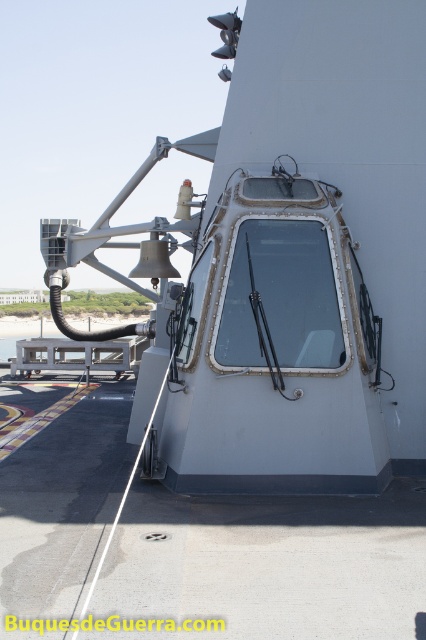
Question: Does gray concrete tarmac at center appear on the left side of transparent glass window at center?

Choices:
 (A) yes
 (B) no

Answer: (B)

Question: Is gray metallic hatch at center positioned behind white matte deck at center?

Choices:
 (A) yes
 (B) no

Answer: (B)

Question: Which point is farther to the camera?

Choices:
 (A) (250, 332)
 (B) (241, 577)
 (C) (334, 376)
 (D) (20, 364)

Answer: (D)

Question: Estimate the real-world distances between objects in this image. Which object is closer to the transparent glass window at center?

Choices:
 (A) gray concrete tarmac at center
 (B) white matte deck at center

Answer: (A)

Question: Which of the following is the closest to the observer?

Choices:
 (A) gray metallic hatch at center
 (B) white matte deck at center
 (C) transparent glass window at center
 (D) gray concrete tarmac at center

Answer: (D)

Question: Is gray concrete tarmac at center to the left of white matte deck at center from the viewer's perspective?

Choices:
 (A) yes
 (B) no

Answer: (B)